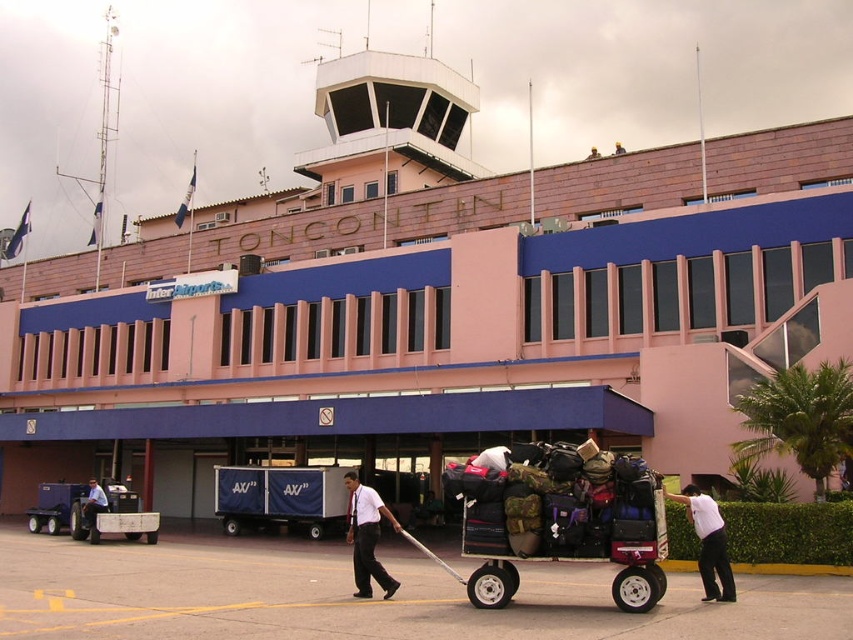
Question: In this image, where is metallic luggage cart at center located relative to white cotton shirt at lower right?

Choices:
 (A) below
 (B) above

Answer: (B)

Question: Which object is closer to the camera taking this photo?

Choices:
 (A) white cotton shirt at lower right
 (B) metallic luggage cart at center
 (C) white shirt at center

Answer: (B)

Question: Among these points, which one is nearest to the camera?

Choices:
 (A) (538, 454)
 (B) (323, 621)
 (C) (695, 502)
 (D) (97, 500)

Answer: (B)

Question: Which of the following is the farthest from the observer?

Choices:
 (A) (688, 513)
 (B) (97, 531)

Answer: (B)

Question: Can you confirm if smooth asphalt tarmac at center is positioned below white cotton shirt at lower right?

Choices:
 (A) no
 (B) yes

Answer: (B)

Question: Can you confirm if metallic luggage cart at center is positioned to the left of metallic blue cart at left?

Choices:
 (A) no
 (B) yes

Answer: (A)